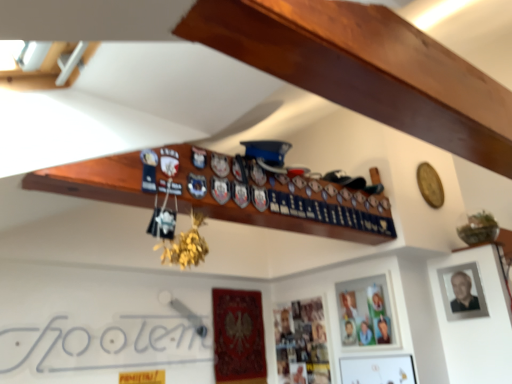
The width and height of the screenshot is (512, 384). Describe the element at coordinates (301, 343) in the screenshot. I see `metallic silver photo frame at lower center, positioned as the first picture frame in left-to-right order` at that location.

The image size is (512, 384). What are the coordinates of `white paper at lower left` in the screenshot? It's located at (103, 344).

What is the approximate width of matte black photo frame at upper right, arranged as the first picture frame when viewed from the right?

It is 2.32 inches.

In order to face matte wooden picture frame at center, which is the second picture frame from left to right, should I rotate leftwards or rightwards?

You should look right and rotate roughly 14.185 degrees.

Identify the location of matte wooden picture frame at center, the 2th picture frame in the right-to-left sequence. The width and height of the screenshot is (512, 384). (367, 312).

What are the coordinates of `metallic silver photo frame at lower center, positioned as the first picture frame in left-to-right order` in the screenshot? It's located at (301, 343).

Does metallic silver photo frame at lower center, which ranks as the third picture frame in right-to-left order, appear on the left side of white paper at lower left?

In fact, metallic silver photo frame at lower center, which ranks as the third picture frame in right-to-left order, is to the right of white paper at lower left.

How many degrees apart are the facing directions of metallic silver photo frame at lower center, positioned as the first picture frame in left-to-right order, and white paper at lower left?

The angle between the facing direction of metallic silver photo frame at lower center, positioned as the first picture frame in left-to-right order, and the facing direction of white paper at lower left is 88.8 degrees.

Looking at this image, is the surface of metallic silver photo frame at lower center, positioned as the first picture frame in left-to-right order, in direct contact with white paper at lower left?

No.

Does point (473, 305) come in front of point (297, 347)?

Yes.

Identify the location of the 2nd picture frame directly beneath the matte black photo frame at upper right, acting as the 3th picture frame starting from the left (from a real-world perspective). This screenshot has height=384, width=512. (301, 343).

In the scene shown: Which object is thinner, matte black photo frame at upper right, acting as the 3th picture frame starting from the left, or metallic silver photo frame at lower center, positioned as the first picture frame in left-to-right order?

matte black photo frame at upper right, acting as the 3th picture frame starting from the left.

Is matte black photo frame at upper right, acting as the 3th picture frame starting from the left, next to metallic silver photo frame at lower center, which ranks as the third picture frame in right-to-left order, and touching it?

No, matte black photo frame at upper right, acting as the 3th picture frame starting from the left, is not beside metallic silver photo frame at lower center, which ranks as the third picture frame in right-to-left order.

Locate an element on the screen. This screenshot has width=512, height=384. the 2nd picture frame below the matte black photo frame at upper right, arranged as the first picture frame when viewed from the right (from the image's perspective) is located at coordinates [x=301, y=343].

Can you tell me how much metallic silver photo frame at lower center, positioned as the first picture frame in left-to-right order, and matte black photo frame at upper right, arranged as the first picture frame when viewed from the right, differ in facing direction?

There is a 0.00143-degree angle between the facing directions of metallic silver photo frame at lower center, positioned as the first picture frame in left-to-right order, and matte black photo frame at upper right, arranged as the first picture frame when viewed from the right.

Considering the sizes of objects metallic silver photo frame at lower center, positioned as the first picture frame in left-to-right order, and matte black photo frame at upper right, acting as the 3th picture frame starting from the left, in the image provided, who is wider, metallic silver photo frame at lower center, positioned as the first picture frame in left-to-right order, or matte black photo frame at upper right, acting as the 3th picture frame starting from the left,?

Wider between the two is metallic silver photo frame at lower center, positioned as the first picture frame in left-to-right order.

Who is taller, white paper at lower left or metallic silver photo frame at lower center, which ranks as the third picture frame in right-to-left order?

metallic silver photo frame at lower center, which ranks as the third picture frame in right-to-left order, is taller.

Find the location of a particular element. The width and height of the screenshot is (512, 384). signature on the left of metallic silver photo frame at lower center, which ranks as the third picture frame in right-to-left order is located at coordinates (103, 344).

Is white paper at lower left next to metallic silver photo frame at lower center, positioned as the first picture frame in left-to-right order, and touching it?

No, white paper at lower left is not in contact with metallic silver photo frame at lower center, positioned as the first picture frame in left-to-right order.

Is white paper at lower left aimed at metallic silver photo frame at lower center, which ranks as the third picture frame in right-to-left order?

No, white paper at lower left is not oriented towards metallic silver photo frame at lower center, which ranks as the third picture frame in right-to-left order.

Consider the image. From a real-world perspective, which object stands above the other?

From a 3D spatial view, matte wooden picture frame at center, which is the second picture frame from left to right, is above.

Is matte wooden picture frame at center, which is the second picture frame from left to right, closer to the viewer compared to white paper at lower left?

No, it is not.

Considering the sizes of objects matte wooden picture frame at center, which is the second picture frame from left to right, and white paper at lower left in the image provided, who is smaller, matte wooden picture frame at center, which is the second picture frame from left to right, or white paper at lower left?

matte wooden picture frame at center, which is the second picture frame from left to right.

Based on the photo, considering the sizes of matte wooden picture frame at center, the 2th picture frame in the right-to-left sequence, and white paper at lower left in the image, is matte wooden picture frame at center, the 2th picture frame in the right-to-left sequence, wider or thinner than white paper at lower left?

In the image, matte wooden picture frame at center, the 2th picture frame in the right-to-left sequence, appears to be wider than white paper at lower left.

From the image's perspective, between white paper at lower left and matte black photo frame at upper right, arranged as the first picture frame when viewed from the right, who is located below?

white paper at lower left is shown below in the image.

Is white paper at lower left touching matte black photo frame at upper right, acting as the 3th picture frame starting from the left?

No, white paper at lower left is not with matte black photo frame at upper right, acting as the 3th picture frame starting from the left.

Considering the relative sizes of white paper at lower left and matte black photo frame at upper right, acting as the 3th picture frame starting from the left, in the image provided, is white paper at lower left shorter than matte black photo frame at upper right, acting as the 3th picture frame starting from the left,?

In fact, white paper at lower left may be taller than matte black photo frame at upper right, acting as the 3th picture frame starting from the left.

From the image's perspective, which one is positioned lower, white paper at lower left or matte wooden picture frame at center, which is the second picture frame from left to right?

From the image's view, white paper at lower left is below.

Considering the positions of objects white paper at lower left and matte wooden picture frame at center, the 2th picture frame in the right-to-left sequence, in the image provided, who is in front, white paper at lower left or matte wooden picture frame at center, the 2th picture frame in the right-to-left sequence,?

white paper at lower left is in front.

In the image, is white paper at lower left on the left side or the right side of matte wooden picture frame at center, which is the second picture frame from left to right?

white paper at lower left is positioned on matte wooden picture frame at center, which is the second picture frame from left to right,'s left side.

From the picture: Can you see white paper at lower left touching matte wooden picture frame at center, the 2th picture frame in the right-to-left sequence?

There is a gap between white paper at lower left and matte wooden picture frame at center, the 2th picture frame in the right-to-left sequence.

This screenshot has width=512, height=384. Find the location of `signature located in front of the metallic silver photo frame at lower center, positioned as the first picture frame in left-to-right order`. signature located in front of the metallic silver photo frame at lower center, positioned as the first picture frame in left-to-right order is located at coordinates (103, 344).

The width and height of the screenshot is (512, 384). In order to click on the 2nd picture frame to the right when counting from the metallic silver photo frame at lower center, which ranks as the third picture frame in right-to-left order in this screenshot , I will do `click(462, 292)`.

When comparing their distances from matte wooden picture frame at center, which is the second picture frame from left to right, does metallic silver photo frame at lower center, which ranks as the third picture frame in right-to-left order, or white paper at lower left seem further?

white paper at lower left is positioned further to the anchor matte wooden picture frame at center, which is the second picture frame from left to right.

Considering their positions, is white paper at lower left positioned closer to metallic silver photo frame at lower center, which ranks as the third picture frame in right-to-left order, than matte wooden picture frame at center, which is the second picture frame from left to right?

Among the two, matte wooden picture frame at center, which is the second picture frame from left to right, is located nearer to metallic silver photo frame at lower center, which ranks as the third picture frame in right-to-left order.

Looking at the image, which one is located closer to matte wooden picture frame at center, the 2th picture frame in the right-to-left sequence, matte black photo frame at upper right, arranged as the first picture frame when viewed from the right, or metallic silver photo frame at lower center, positioned as the first picture frame in left-to-right order?

metallic silver photo frame at lower center, positioned as the first picture frame in left-to-right order.

From the image, which object appears to be farther from white paper at lower left, matte wooden picture frame at center, the 2th picture frame in the right-to-left sequence, or matte black photo frame at upper right, arranged as the first picture frame when viewed from the right?

Among the two, matte black photo frame at upper right, arranged as the first picture frame when viewed from the right, is located further to white paper at lower left.

Based on their spatial positions, is matte black photo frame at upper right, arranged as the first picture frame when viewed from the right, or white paper at lower left further from metallic silver photo frame at lower center, which ranks as the third picture frame in right-to-left order?

matte black photo frame at upper right, arranged as the first picture frame when viewed from the right, is positioned further to the anchor metallic silver photo frame at lower center, which ranks as the third picture frame in right-to-left order.

Looking at the image, which one is located closer to matte black photo frame at upper right, arranged as the first picture frame when viewed from the right, metallic silver photo frame at lower center, positioned as the first picture frame in left-to-right order, or white paper at lower left?

metallic silver photo frame at lower center, positioned as the first picture frame in left-to-right order, is positioned closer to the anchor matte black photo frame at upper right, arranged as the first picture frame when viewed from the right.

Based on the photo, when comparing their distances from metallic silver photo frame at lower center, which ranks as the third picture frame in right-to-left order, does white paper at lower left or matte black photo frame at upper right, acting as the 3th picture frame starting from the left, seem closer?

white paper at lower left is closer to metallic silver photo frame at lower center, which ranks as the third picture frame in right-to-left order.

When comparing their distances from metallic silver photo frame at lower center, positioned as the first picture frame in left-to-right order, does matte wooden picture frame at center, which is the second picture frame from left to right, or matte black photo frame at upper right, arranged as the first picture frame when viewed from the right, seem closer?

Among the two, matte wooden picture frame at center, which is the second picture frame from left to right, is located nearer to metallic silver photo frame at lower center, positioned as the first picture frame in left-to-right order.

Find the location of a particular element. The image size is (512, 384). picture frame between metallic silver photo frame at lower center, which ranks as the third picture frame in right-to-left order, and matte black photo frame at upper right, acting as the 3th picture frame starting from the left, from left to right is located at coordinates (367, 312).

Where is `picture frame between white paper at lower left and matte wooden picture frame at center, which is the second picture frame from left to right, in the horizontal direction`? This screenshot has width=512, height=384. picture frame between white paper at lower left and matte wooden picture frame at center, which is the second picture frame from left to right, in the horizontal direction is located at coordinates (301, 343).